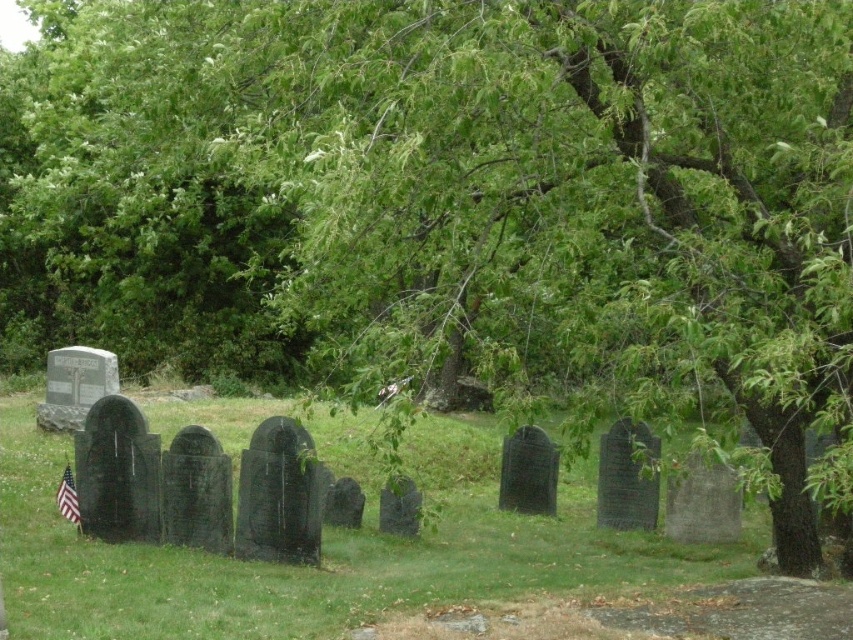
Between point (305, 602) and point (70, 513), which one is positioned in front?

Point (305, 602) is more forward.

Does green grass at center have a smaller size compared to american flag at lower left?

Actually, green grass at center might be larger than american flag at lower left.

Does point (434, 550) come closer to viewer compared to point (71, 476)?

Yes, point (434, 550) is in front of point (71, 476).

Find the location of a particular element. This screenshot has height=640, width=853. green grass at center is located at coordinates (325, 548).